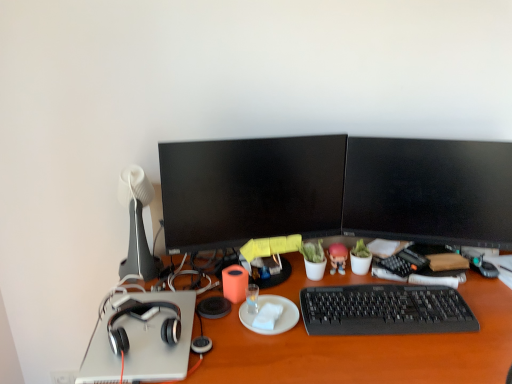
Where is `vacant area that lies to the right of white matte notepad at center`? Image resolution: width=512 pixels, height=384 pixels. vacant area that lies to the right of white matte notepad at center is located at coordinates (331, 330).